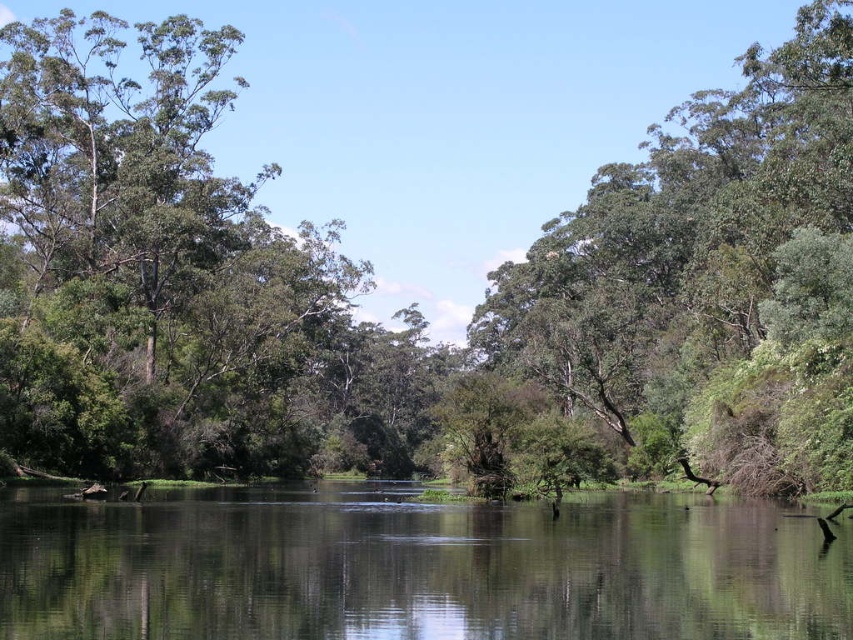
You are a bird looking for a place to perch. You see the green leafy tree at left and the clear water at center. Which location would provide a larger area to rest?

The green leafy tree at left is larger in size than the clear water at center, so it would provide a larger area to rest.

You are standing at the edge of the water in the image and want to determine which tree is taller between the green leafy tree at left and the green leafy tree at center. Based on their positions, can you tell which one is taller?

The green leafy tree at left is taller than the green leafy tree at center according to the description provided.